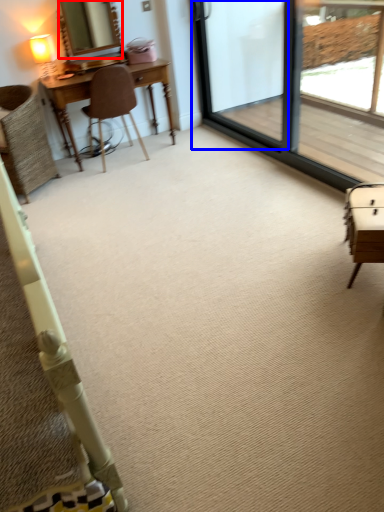
Question: Which object appears farthest to the camera in this image, mirror (highlighted by a red box) or screen door (highlighted by a blue box)?

Choices:
 (A) mirror
 (B) screen door

Answer: (A)